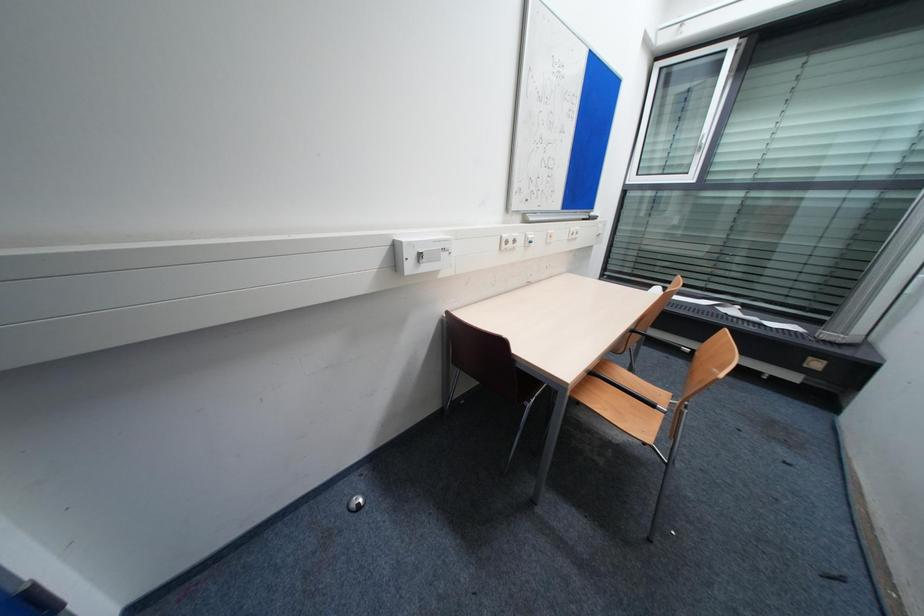
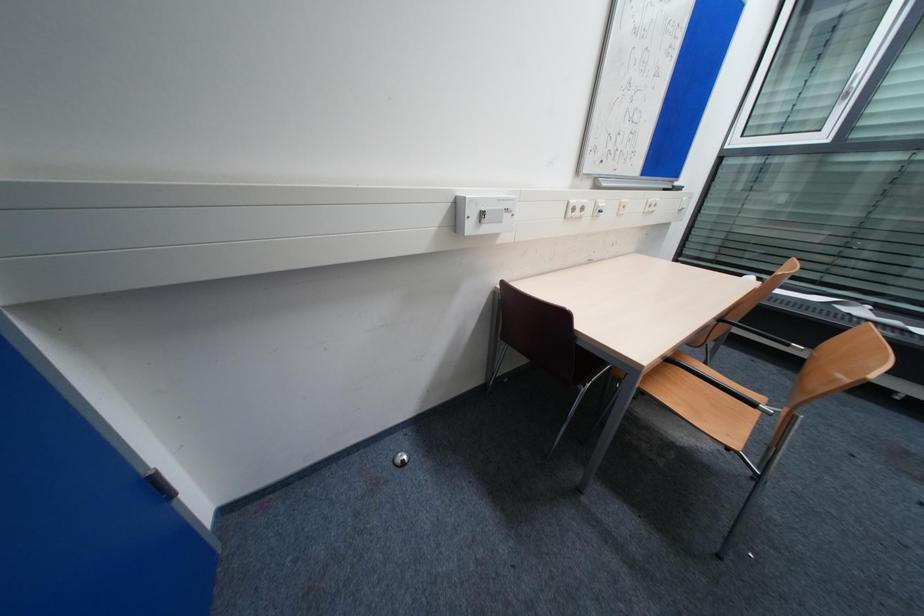
Question: The first image is from the beginning of the video and the second image is from the end. How did the camera likely rotate when shooting the video?

Choices:
 (A) Left
 (B) Right
 (C) Up
 (D) Down

Answer: (A)